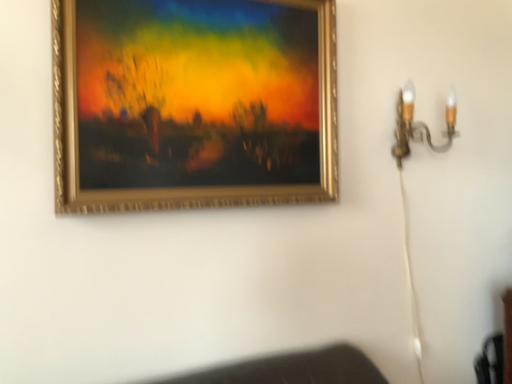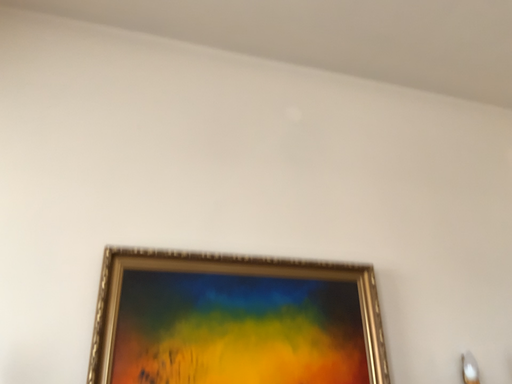
Question: How did the camera likely rotate when shooting the video?

Choices:
 (A) rotated right
 (B) rotated left

Answer: (B)